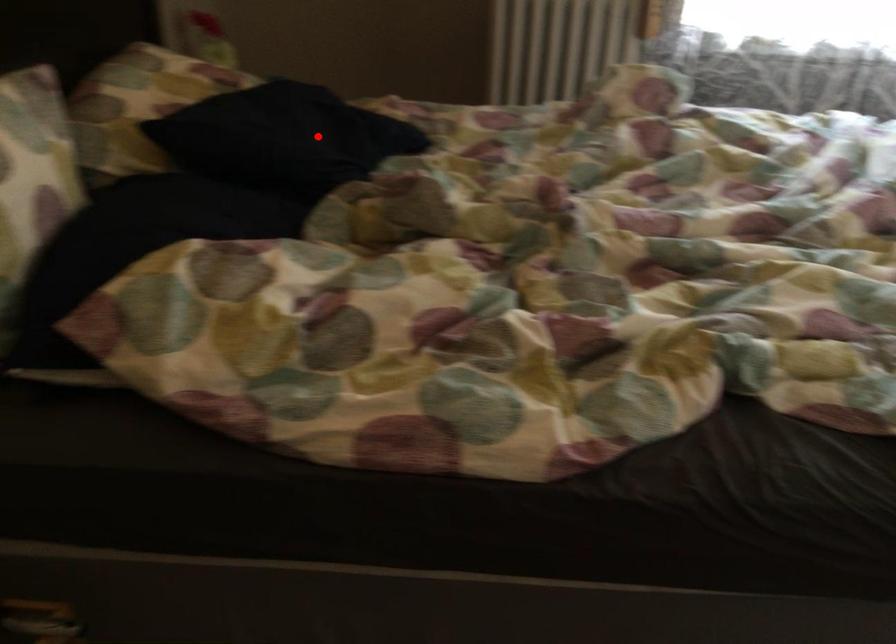
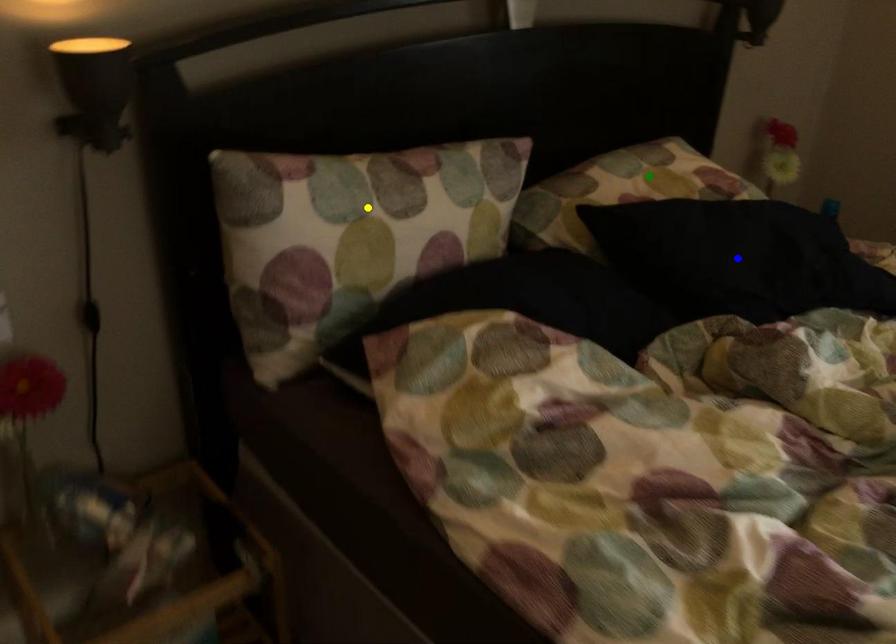
Question: I am providing you with two images of the same scene from different viewpoints. A red point is marked on the first image. You are given multiple points on the second image. Which point in image 2 is actually the same real-world point as the red point in image 1?

Choices:
 (A) yellow point
 (B) blue point
 (C) green point

Answer: (B)